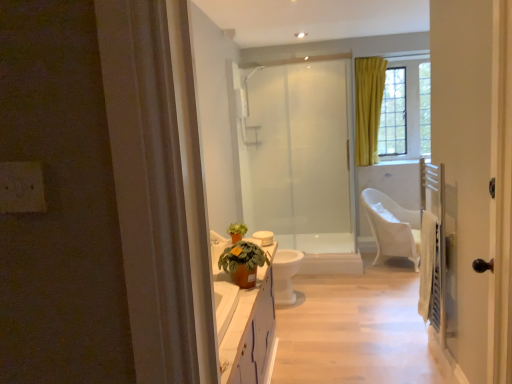
Question: From the image's perspective, is terracotta clay pot at center on white glossy door at right?

Choices:
 (A) no
 (B) yes

Answer: (A)

Question: From the image's perspective, is terracotta clay pot at center below white glossy door at right?

Choices:
 (A) no
 (B) yes

Answer: (B)

Question: Is the depth of terracotta clay pot at center greater than that of white glossy door at right?

Choices:
 (A) no
 (B) yes

Answer: (B)

Question: From a real-world perspective, does terracotta clay pot at center stand above white glossy door at right?

Choices:
 (A) no
 (B) yes

Answer: (A)

Question: Does terracotta clay pot at center appear on the left side of white glossy door at right?

Choices:
 (A) yes
 (B) no

Answer: (A)

Question: Is the depth of terracotta clay pot at center less than that of white glossy door at right?

Choices:
 (A) no
 (B) yes

Answer: (A)

Question: From a real-world perspective, is yellow fabric curtain at upper right on top of white glossy door at right?

Choices:
 (A) no
 (B) yes

Answer: (B)

Question: Is yellow fabric curtain at upper right positioned behind white glossy door at right?

Choices:
 (A) no
 (B) yes

Answer: (B)

Question: Is yellow fabric curtain at upper right not within white glossy door at right?

Choices:
 (A) no
 (B) yes

Answer: (B)

Question: Can you confirm if yellow fabric curtain at upper right is shorter than white glossy door at right?

Choices:
 (A) no
 (B) yes

Answer: (B)

Question: Can you confirm if yellow fabric curtain at upper right is thinner than white glossy door at right?

Choices:
 (A) no
 (B) yes

Answer: (B)

Question: Is there a large distance between yellow fabric curtain at upper right and white glossy door at right?

Choices:
 (A) yes
 (B) no

Answer: (A)

Question: Is white plastic chair at right wider than terracotta clay pot at center?

Choices:
 (A) no
 (B) yes

Answer: (B)